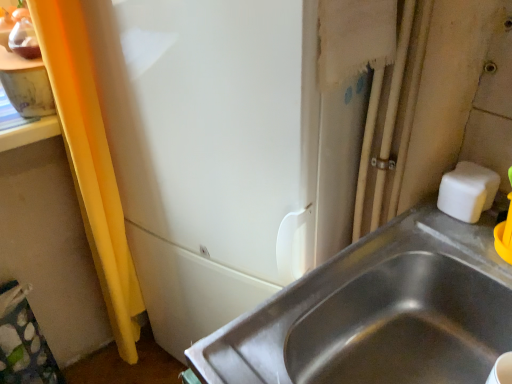
Question: From the image's perspective, is stainless steel sink at lower right on top of white matte soap at upper right?

Choices:
 (A) no
 (B) yes

Answer: (A)

Question: Is stainless steel sink at lower right to the right of white matte soap at upper right from the viewer's perspective?

Choices:
 (A) no
 (B) yes

Answer: (A)

Question: Does stainless steel sink at lower right come in front of white matte soap at upper right?

Choices:
 (A) no
 (B) yes

Answer: (B)

Question: Considering the relative sizes of stainless steel sink at lower right and white matte soap at upper right in the image provided, is stainless steel sink at lower right bigger than white matte soap at upper right?

Choices:
 (A) no
 (B) yes

Answer: (B)

Question: Could you tell me if stainless steel sink at lower right is turned towards white matte soap at upper right?

Choices:
 (A) yes
 (B) no

Answer: (B)

Question: Is stainless steel sink at lower right located outside white matte soap at upper right?

Choices:
 (A) yes
 (B) no

Answer: (A)

Question: Can you confirm if white matte soap at upper right is wider than stainless steel sink at lower right?

Choices:
 (A) yes
 (B) no

Answer: (B)

Question: Is the depth of white matte soap at upper right greater than that of stainless steel sink at lower right?

Choices:
 (A) no
 (B) yes

Answer: (B)

Question: Is white matte soap at upper right taller than stainless steel sink at lower right?

Choices:
 (A) yes
 (B) no

Answer: (B)

Question: Would you say stainless steel sink at lower right is part of white matte soap at upper right's contents?

Choices:
 (A) yes
 (B) no

Answer: (B)

Question: Is the surface of white matte soap at upper right in direct contact with stainless steel sink at lower right?

Choices:
 (A) yes
 (B) no

Answer: (B)

Question: Would you consider white matte soap at upper right to be distant from stainless steel sink at lower right?

Choices:
 (A) yes
 (B) no

Answer: (B)

Question: From a real-world perspective, is stainless steel sink at lower right above or below white matte soap at upper right?

Choices:
 (A) above
 (B) below

Answer: (B)